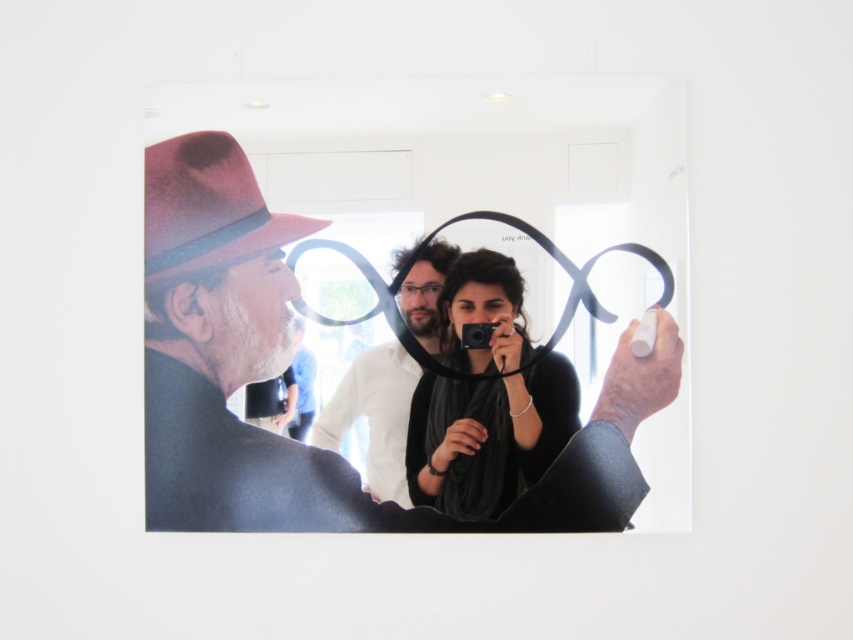
Question: Which of these objects is positioned closest to the black plastic camera at center?

Choices:
 (A) white matte shirt at center
 (B) matte black camera at center
 (C) matte black suit at center

Answer: (B)

Question: Is matte black suit at center further to camera compared to matte black camera at center?

Choices:
 (A) no
 (B) yes

Answer: (A)

Question: Does matte black suit at center appear under white matte shirt at center?

Choices:
 (A) no
 (B) yes

Answer: (B)

Question: Is matte black camera at center closer to camera compared to black plastic camera at center?

Choices:
 (A) yes
 (B) no

Answer: (A)

Question: Based on their relative distances, which object is nearer to the matte black camera at center?

Choices:
 (A) matte black suit at center
 (B) white matte shirt at center

Answer: (B)

Question: Based on their relative distances, which object is nearer to the black plastic camera at center?

Choices:
 (A) matte black camera at center
 (B) white matte shirt at center
 (C) matte black suit at center

Answer: (A)